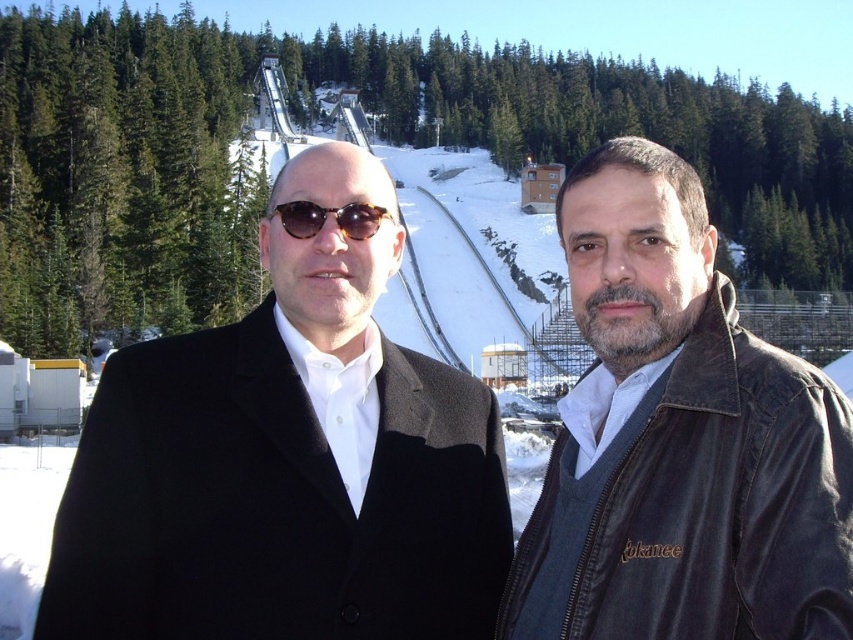
Question: Which of the following is the closest to the observer?

Choices:
 (A) black wool coat at left
 (B) matte black sunglasses at center
 (C) leather jacket at right

Answer: (C)

Question: Which object is farther from the camera taking this photo?

Choices:
 (A) black wool coat at left
 (B) matte black sunglasses at center
 (C) leather jacket at right

Answer: (B)

Question: Is the position of leather jacket at right more distant than that of matte black sunglasses at center?

Choices:
 (A) yes
 (B) no

Answer: (B)

Question: Estimate the real-world distances between objects in this image. Which object is closer to the black wool coat at left?

Choices:
 (A) leather jacket at right
 (B) matte black sunglasses at center

Answer: (B)

Question: Can you confirm if leather jacket at right is positioned above matte black sunglasses at center?

Choices:
 (A) yes
 (B) no

Answer: (B)

Question: Can you confirm if leather jacket at right is positioned above matte black sunglasses at center?

Choices:
 (A) yes
 (B) no

Answer: (B)